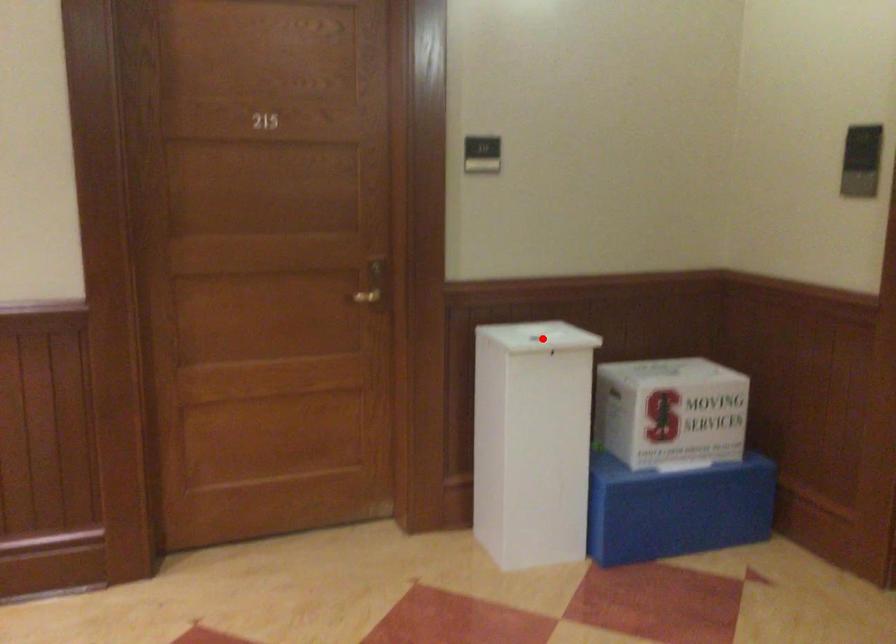
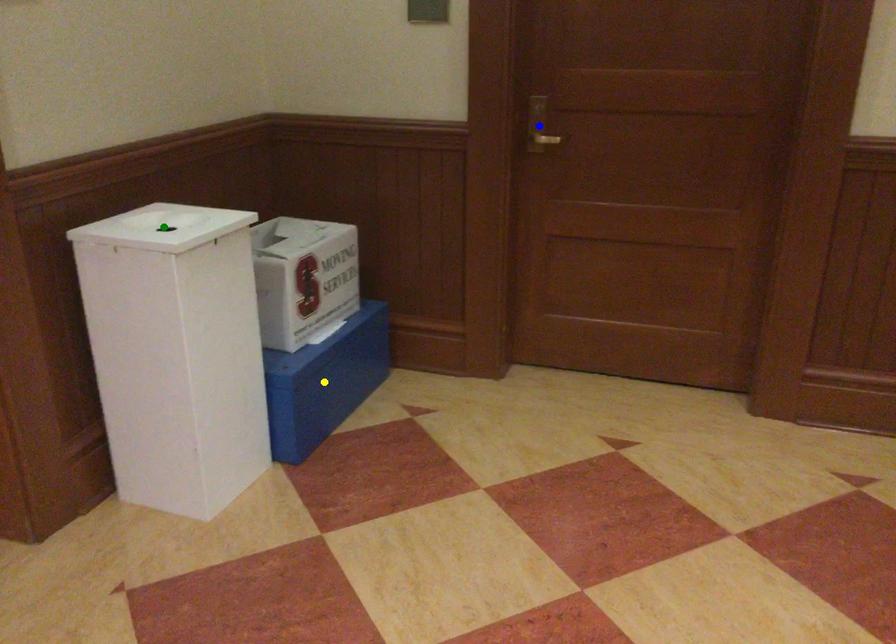
Question: I am providing you with two images of the same scene from different viewpoints. A red point is marked on the first image. You are given multiple points on the second image. Which spot in image 2 lines up with the point in image 1?

Choices:
 (A) blue point
 (B) yellow point
 (C) green point

Answer: (C)